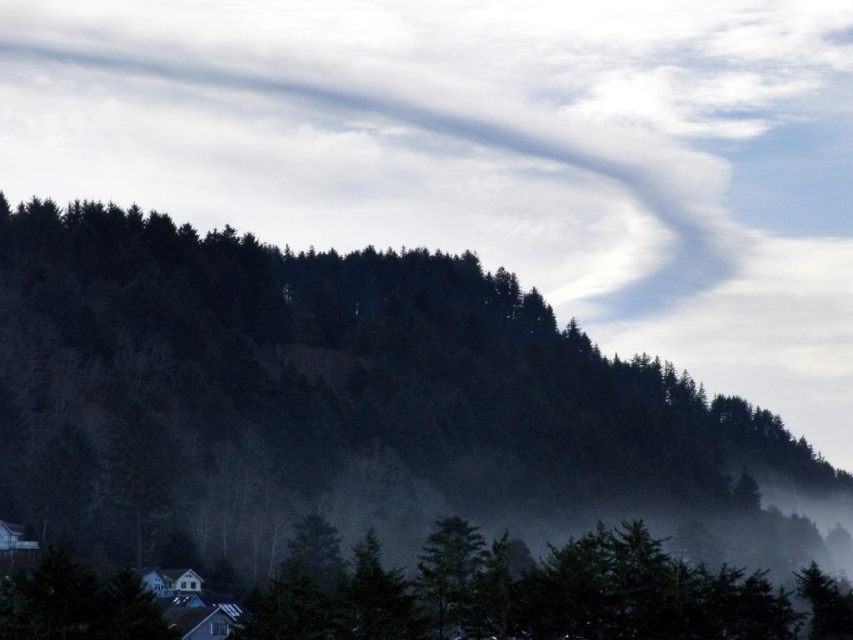
You are standing in front of the forest scene. You see the green matte trees at center and the green matte tree at lower center. Which of these two objects is positioned higher in the image?

The green matte trees at center is positioned higher in the image than the green matte tree at lower center.

You are a hiker who wants to cross the forest from the lower center to the center area. The trail is straight and narrow. Your backpack has a 230 feet rope. Can you safely use the rope to cross the gap between the green matte tree at lower center and the green matte trees at center?

The distance between the green matte trees at center and the green matte tree at lower center is 229.86 feet, which is just under the 230 feet length of your rope. Therefore, the rope can safely span the gap, allowing you to cross.

You are standing in a forest and see the green matte trees at center and the green matte tree at lower center. Which one is closer to you?

The green matte tree at lower center is behind the green matte trees at center, so the green matte trees at center are closer to you.